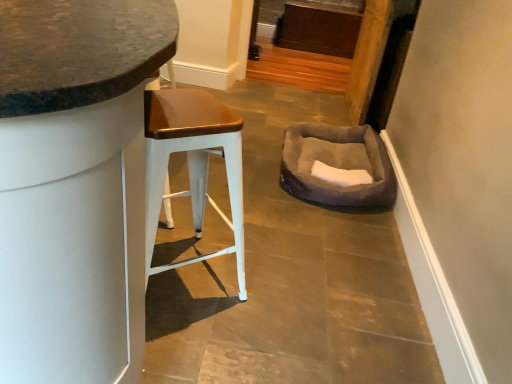
Where is `matte white stool at left`? matte white stool at left is located at coordinates (75, 185).

The image size is (512, 384). Identify the location of suede-like gray bean bag at center-right. (337, 165).

This screenshot has height=384, width=512. Identify the location of matte white stool at left. (75, 185).

Considering the sizes of objects white metal stool at left and matte white stool at left in the image provided, who is thinner, white metal stool at left or matte white stool at left?

Thinner between the two is white metal stool at left.

Is white metal stool at left oriented away from matte white stool at left?

Yes, white metal stool at left is positioned with its back facing matte white stool at left.

Which is more to the left, white metal stool at left or matte white stool at left?

Positioned to the left is matte white stool at left.

The height and width of the screenshot is (384, 512). Find the location of `cabinetry that appears in front of the white metal stool at left`. cabinetry that appears in front of the white metal stool at left is located at coordinates (75, 185).

Is suede-like gray bean bag at center-right oriented away from matte white stool at left?

suede-like gray bean bag at center-right is not turned away from matte white stool at left.

From the image's perspective, is suede-like gray bean bag at center-right under matte white stool at left?

Yes.

Is suede-like gray bean bag at center-right not close to matte white stool at left?

Yes.

Between point (329, 160) and point (152, 27), which one is positioned in front?

The point (152, 27) is in front.

Can you tell me how much matte white stool at left and white metal stool at left differ in facing direction?

They differ by 53.2 degrees in their facing directions.

Is matte white stool at left aimed at white metal stool at left?

No, matte white stool at left is not aimed at white metal stool at left.

Is matte white stool at left not close to white metal stool at left?

No, matte white stool at left is in close proximity to white metal stool at left.

Between matte white stool at left and white metal stool at left, which one is positioned behind?

white metal stool at left is further away from the camera.

From the image's perspective, is suede-like gray bean bag at center-right above white metal stool at left?

Indeed, from the image's perspective, suede-like gray bean bag at center-right is shown above white metal stool at left.

From a real-world perspective, which is physically above, suede-like gray bean bag at center-right or white metal stool at left?

white metal stool at left is physically above.

Is white metal stool at left inside suede-like gray bean bag at center-right?

That's incorrect, white metal stool at left is not inside suede-like gray bean bag at center-right.

This screenshot has height=384, width=512. In order to click on bean bag chair beneath the white metal stool at left (from a real-world perspective) in this screenshot , I will do `click(337, 165)`.

Is matte white stool at left shorter than suede-like gray bean bag at center-right?

In fact, matte white stool at left may be taller than suede-like gray bean bag at center-right.

Between matte white stool at left and suede-like gray bean bag at center-right, which one is positioned in front?

matte white stool at left.

Is point (80, 32) in front of point (345, 142)?

Yes, it is.

Would you say matte white stool at left is inside or outside suede-like gray bean bag at center-right?

The correct answer is: outside.

Is white metal stool at left to the right of suede-like gray bean bag at center-right from the viewer's perspective?

Incorrect, white metal stool at left is not on the right side of suede-like gray bean bag at center-right.

Is point (155, 124) positioned behind point (385, 153)?

No, it is not.

Considering the sizes of objects white metal stool at left and suede-like gray bean bag at center-right in the image provided, who is bigger, white metal stool at left or suede-like gray bean bag at center-right?

Bigger between the two is suede-like gray bean bag at center-right.

At what (x,y) coordinates should I click in order to perform the action: click on stool on the right of the matte white stool at left. Please return your answer as a coordinate pair (x, y). Looking at the image, I should click on (193, 163).

Where is `bean bag chair below the matte white stool at left (from the image's perspective)`? bean bag chair below the matte white stool at left (from the image's perspective) is located at coordinates (337, 165).

From the image, which object appears to be nearer to matte white stool at left, suede-like gray bean bag at center-right or white metal stool at left?

Among the two, white metal stool at left is located nearer to matte white stool at left.

Based on the photo, from the image, which object appears to be nearer to white metal stool at left, matte white stool at left or suede-like gray bean bag at center-right?

Among the two, matte white stool at left is located nearer to white metal stool at left.

When comparing their distances from suede-like gray bean bag at center-right, does matte white stool at left or white metal stool at left seem further?

Among the two, matte white stool at left is located further to suede-like gray bean bag at center-right.

When comparing their distances from white metal stool at left, does suede-like gray bean bag at center-right or matte white stool at left seem closer?

Based on the image, matte white stool at left appears to be nearer to white metal stool at left.

When comparing their distances from suede-like gray bean bag at center-right, does white metal stool at left or matte white stool at left seem further?

The object further to suede-like gray bean bag at center-right is matte white stool at left.

Looking at this image, from the image, which object appears to be nearer to matte white stool at left, white metal stool at left or suede-like gray bean bag at center-right?

Among the two, white metal stool at left is located nearer to matte white stool at left.

Locate an element on the screen. This screenshot has width=512, height=384. stool between matte white stool at left and suede-like gray bean bag at center-right in the front-back direction is located at coordinates (193, 163).